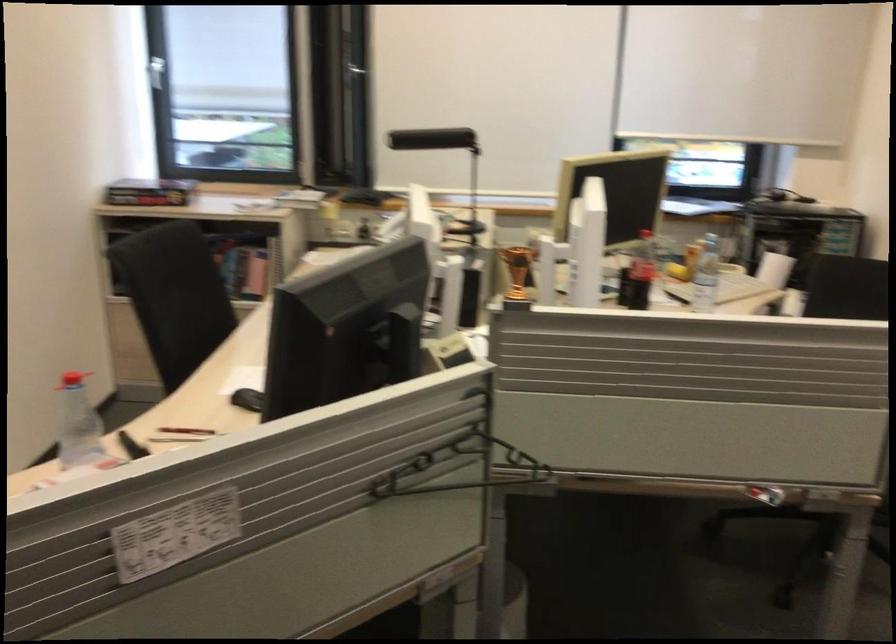
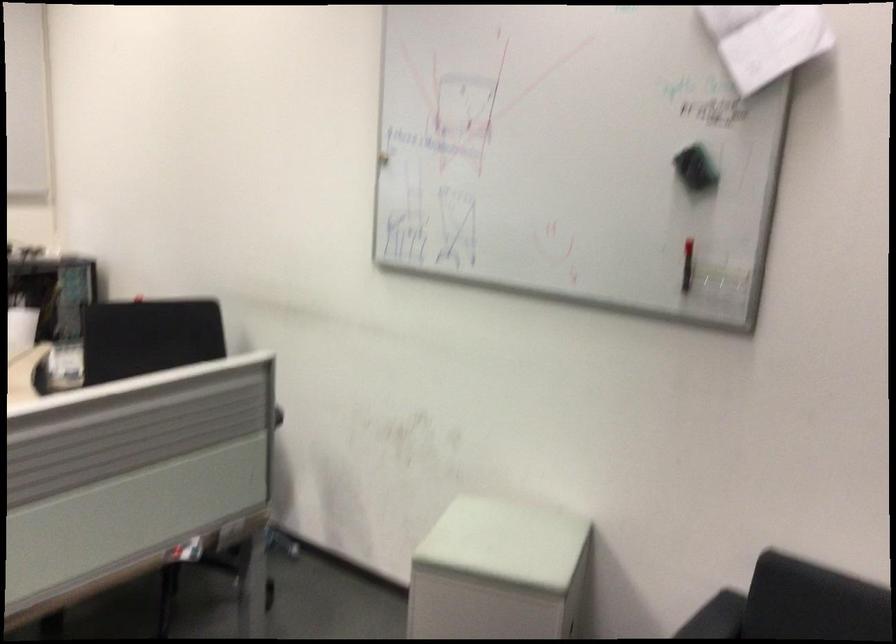
Question: The camera is either moving clockwise (left) or counter-clockwise (right) around the object. The first image is from the beginning of the video and the second image is from the end. Is the camera moving left or right when shooting the video?

Choices:
 (A) Left
 (B) Right

Answer: (A)